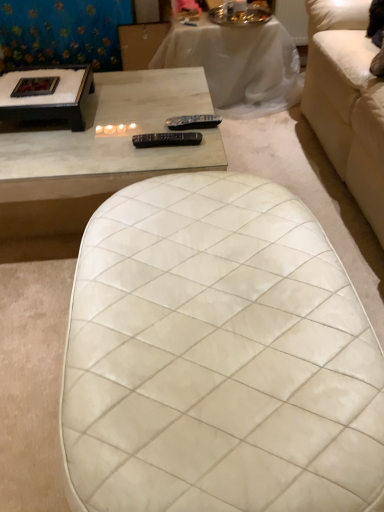
Image resolution: width=384 pixels, height=512 pixels. I want to click on free point above black wood coffee table at upper left, which ranks as the first coffee table in left-to-right order (from a real-world perspective), so click(x=25, y=83).